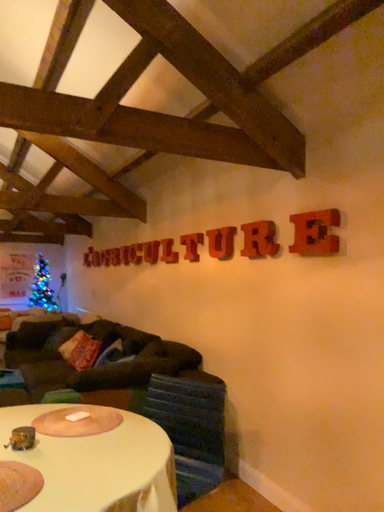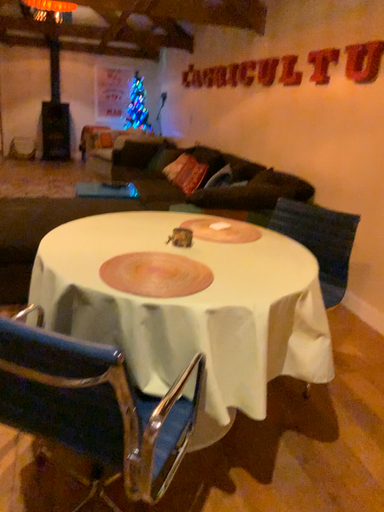
Question: How did the camera likely rotate when shooting the video?

Choices:
 (A) rotated right
 (B) rotated left

Answer: (B)